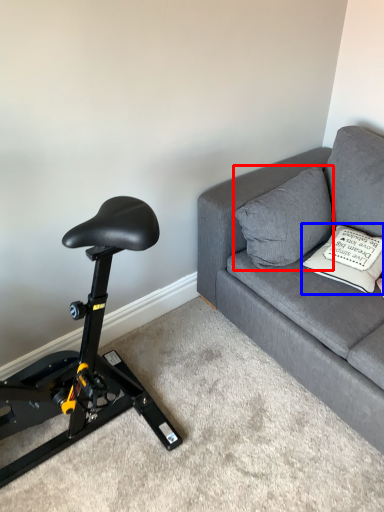
Question: Which point is further to the camera, pillow (highlighted by a red box) or pillow (highlighted by a blue box)?

Choices:
 (A) pillow
 (B) pillow

Answer: (A)